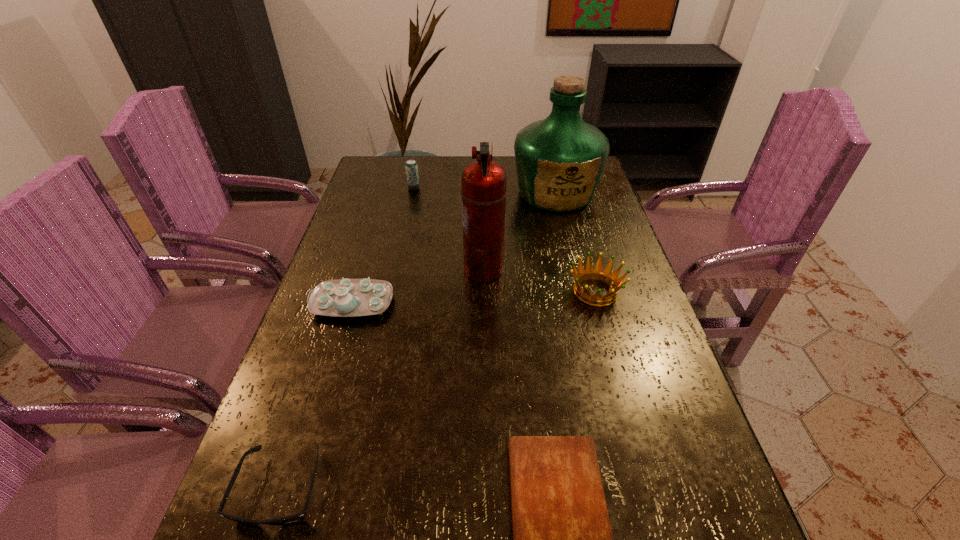
You are a GUI agent. You are given a task and a screenshot of the screen. Output one action in this format:
    pyautogui.click(x=<x>, y=<y>)
    Task: Click on the vacant space at the left edge of the desktop
    
    Given the screenshot: What is the action you would take?
    pyautogui.click(x=401, y=199)

This screenshot has height=540, width=960. Find the location of `vacant space at the right edge of the desktop`. vacant space at the right edge of the desktop is located at coordinates (632, 346).

The image size is (960, 540). Find the location of `empty space that is in between the crown and the chinaware`. empty space that is in between the crown and the chinaware is located at coordinates [474, 297].

You are a GUI agent. You are given a task and a screenshot of the screen. Output one action in this format:
    pyautogui.click(x=<x>, y=<y>)
    Task: Click on the free point between the liquor and the crown
    
    Given the screenshot: What is the action you would take?
    pyautogui.click(x=575, y=242)

The image size is (960, 540). Identify the location of empty space between the beer can and the crown. (505, 240).

Find the location of a particular element. unoccupied position between the beer can and the fire extinguisher is located at coordinates (448, 229).

Find the location of `unoccupied area between the liquor and the fire extinguisher`. unoccupied area between the liquor and the fire extinguisher is located at coordinates (519, 231).

You are a GUI agent. You are given a task and a screenshot of the screen. Output one action in this format:
    pyautogui.click(x=<x>, y=<y>)
    Task: Click on the vacant area between the beer can and the sixth tallest object
    The image size is (960, 540).
    Given the screenshot: What is the action you would take?
    pyautogui.click(x=348, y=339)

Locate an element on the screen. vacant area between the chinaware and the crown is located at coordinates (474, 297).

I want to click on vacant area that lies between the crown and the liquor, so click(575, 242).